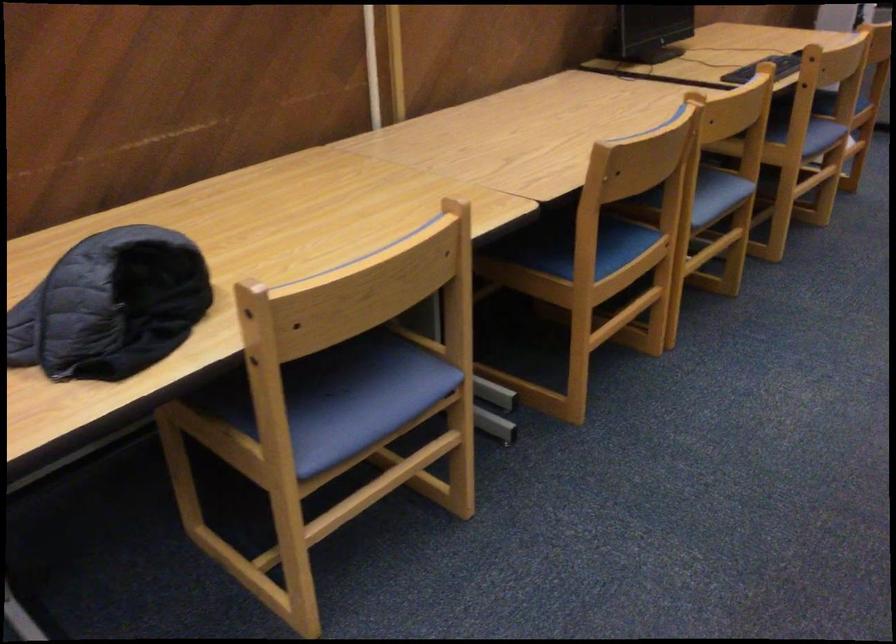
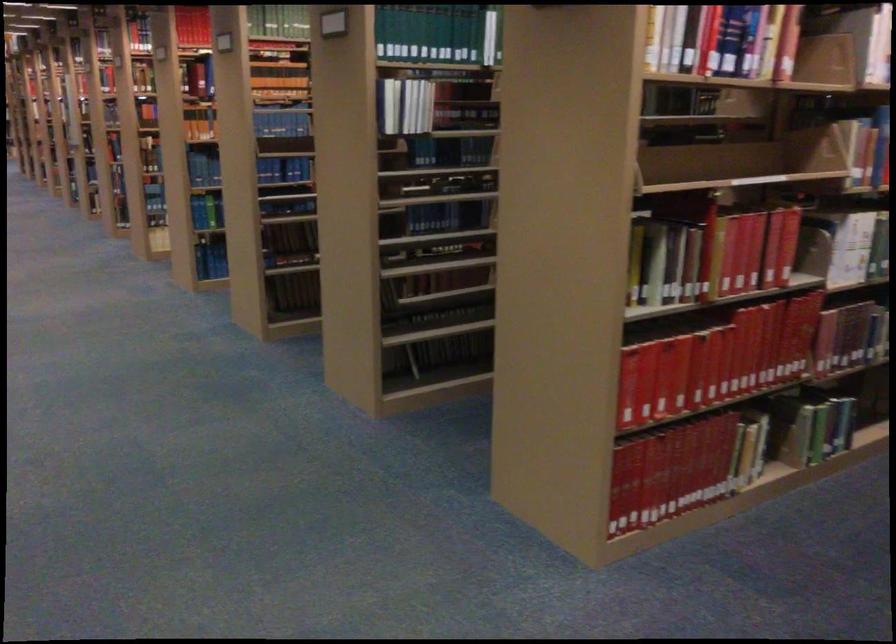
Question: Based on the continuous images, in which direction is the camera rotating? Reply with the corresponding letter.

Choices:
 (A) Left
 (B) Right
 (C) Up
 (D) Down

Answer: (B)